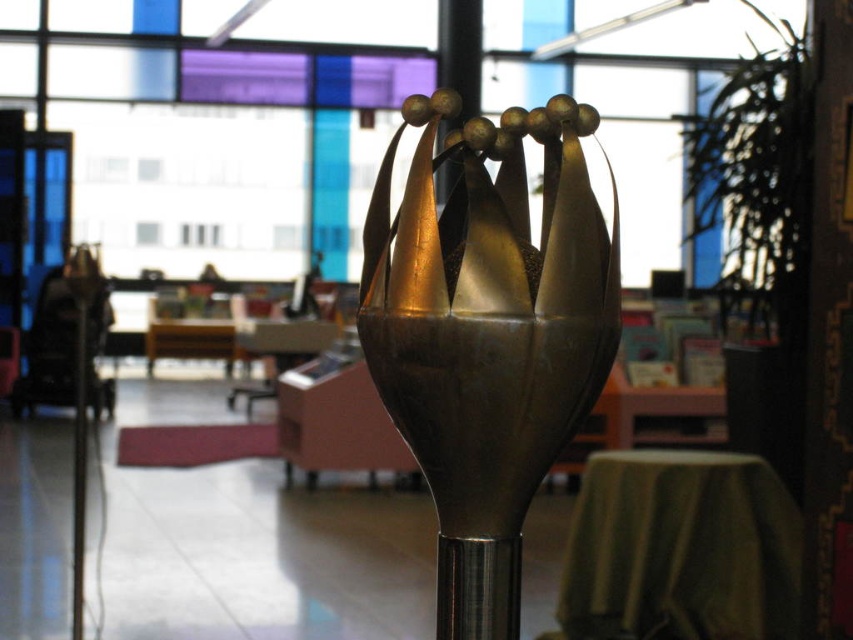
You are a guest in a modern library and see the gold polished metal crown at center and the green fabric table at center. Which object is smaller in size?

The gold polished metal crown at center is smaller in size compared to the green fabric table at center.

You are organizing a small event and need to place a 1.2 meter wide decorative item on the pink matte table at center. Considering the table and pole dimensions, will the item fit on the table without touching the metallic pole at center?

The pink matte table at center is wider than the metallic pole at center. However, the exact dimensions of the table and pole are not provided. Without knowing the specific width of the table, it is impossible to determine if the 1.2 meter wide item will fit without touching the pole.

You are a museum curator planning to display the gold polished metal crown at center and the green fabric table at center in a new exhibition. The exhibition requires that the two items must be placed exactly 1.2 meters apart. Based on the image, will their current positioning meet this requirement?

The gold polished metal crown at center is 1.23 meters away from the green fabric table at center. Since 1.23 meters is slightly more than the required 1.2 meters, their current positioning does not exactly meet the exhibition requirement.